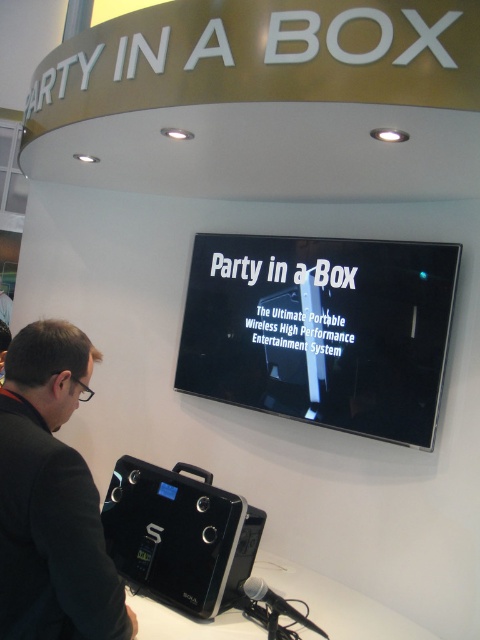
Question: Can you confirm if black fabric jacket at lower left is wider than black plastic speaker at lower center?

Choices:
 (A) yes
 (B) no

Answer: (B)

Question: Which object is closer to the camera taking this photo?

Choices:
 (A) black glossy sign at center
 (B) black fabric jacket at lower left

Answer: (B)

Question: Is black glossy sign at center to the left of black plastic speaker at lower center from the viewer's perspective?

Choices:
 (A) yes
 (B) no

Answer: (B)

Question: Which of the following is the farthest from the observer?

Choices:
 (A) (206, 605)
 (B) (412, 291)

Answer: (B)

Question: Which is nearer to the black glossy sign at center?

Choices:
 (A) black fabric jacket at lower left
 (B) black plastic speaker at lower center

Answer: (B)

Question: Can you confirm if black fabric jacket at lower left is positioned below black plastic speaker at lower center?

Choices:
 (A) yes
 (B) no

Answer: (B)